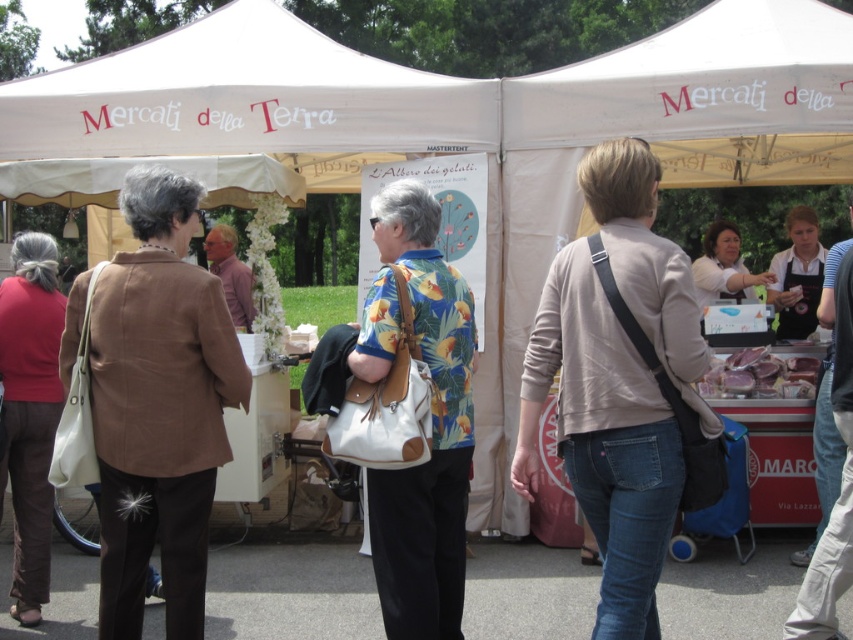
Question: Is white fabric canopy at upper center closer to the viewer compared to black apron at right?

Choices:
 (A) no
 (B) yes

Answer: (B)

Question: Which of the following is the closest to the observer?

Choices:
 (A) (572, 262)
 (B) (711, 252)

Answer: (A)

Question: Is light brown leather jacket at center thinner than black apron at right?

Choices:
 (A) yes
 (B) no

Answer: (A)

Question: Which point is farther to the camera?

Choices:
 (A) (231, 8)
 (B) (654, 356)

Answer: (A)

Question: Among these points, which one is farthest from the camera?

Choices:
 (A) (735, 260)
 (B) (743, 374)

Answer: (A)

Question: Is light brown leather jacket at center further to the viewer compared to brown leather jacket at left?

Choices:
 (A) yes
 (B) no

Answer: (B)